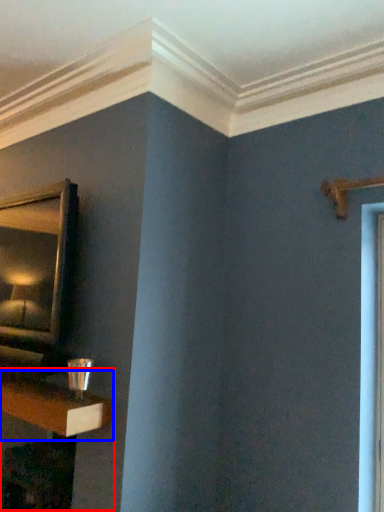
Question: Which of the following is the closest to the observer, table (highlighted by a red box) or shelf (highlighted by a blue box)?

Choices:
 (A) table
 (B) shelf

Answer: (B)